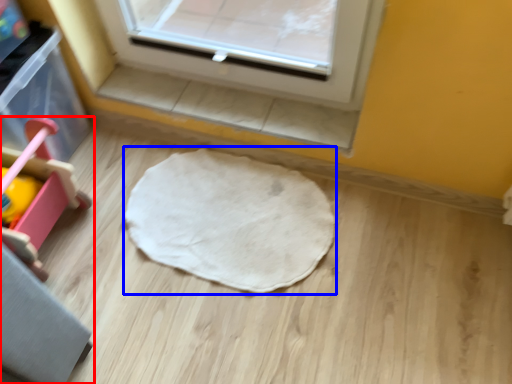
Question: Which object is closer to the camera taking this photo, furniture (highlighted by a red box) or mat (highlighted by a blue box)?

Choices:
 (A) furniture
 (B) mat

Answer: (A)